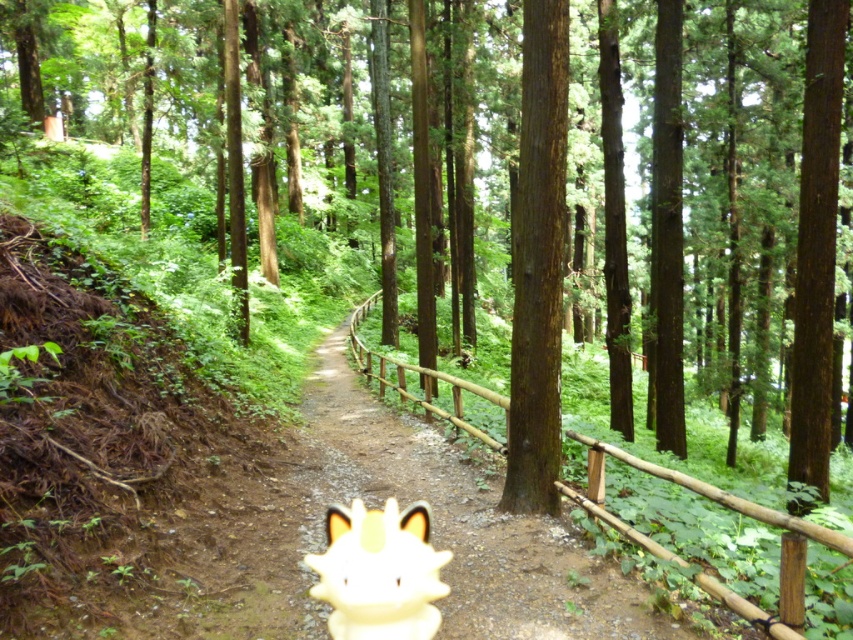
You are a hiker walking along the dirt path in the forest. You see a brown rough bark tree at center and a white glossy figurine at center. Which object is closer to you?

The brown rough bark tree at center is closer to you than the white glossy figurine at center.

You are standing at the center of the dirt path in the forest. You want to locate the brown rough bark tree at center. Which direction should you look to find it?

The brown rough bark tree at center is located at point coordinates of 0.412 on the x axis and 0.632 on the y axis, so you should look towards the center of the dirt path to find it.

Looking at this image, you are a hiker walking along the dirt path in the forest. You notice a brown rough bark tree at center and a white glossy figurine at center. Which object is positioned higher relative to the other?

The brown rough bark tree at center is above the white glossy figurine at center, so the brown rough bark tree at center is positioned higher than the white glossy figurine at center.